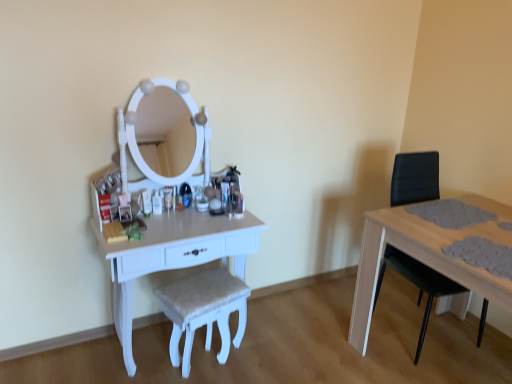
The height and width of the screenshot is (384, 512). What are the coordinates of `free space between white glossy table at left and black leather swivel chair at right` in the screenshot? It's located at (304, 336).